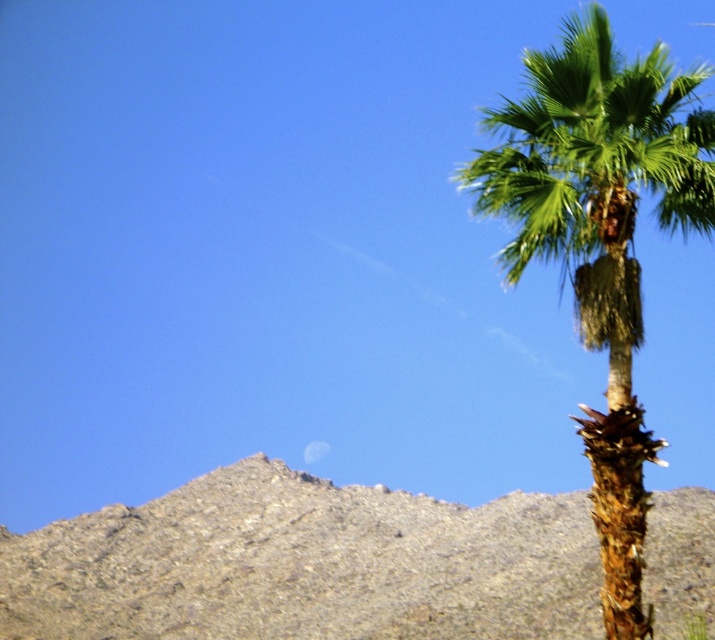
You are a hiker planning to take a photo of the gray rocky mountain at center from the palm tree on the right. Based on their positions, will the palm tree block your view of the mountain?

The gray rocky mountain at center is located at point (305, 564), which means it is positioned in the upper part of the image. Since the palm tree is on the right side, its placement would not obstruct the view of the mountain located centrally. Therefore, the palm tree will not block your view of the gray rocky mountain at center.

Based on the scene description, can you determine if the gray rocky mountain at center is wider than the green leafy palm at right?

The gray rocky mountain at center might be wider than green leafy palm at right.